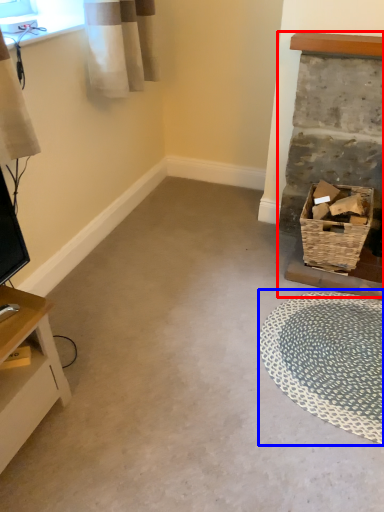
Question: Which object appears closest to the camera in this image, fireplace (highlighted by a red box) or mat (highlighted by a blue box)?

Choices:
 (A) fireplace
 (B) mat

Answer: (B)